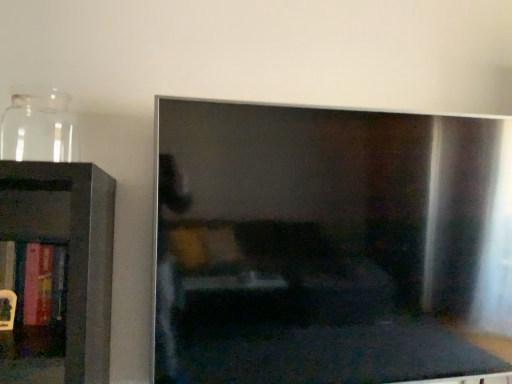
Question: In the image, is transparent glass jar at left on the left side or the right side of hardcover book at left?

Choices:
 (A) right
 (B) left

Answer: (A)

Question: Is transparent glass jar at left in front of or behind hardcover book at left in the image?

Choices:
 (A) behind
 (B) front

Answer: (B)

Question: Looking at their shapes, would you say transparent glass jar at left is wider or thinner than hardcover book at left?

Choices:
 (A) wide
 (B) thin

Answer: (A)

Question: Based on their sizes in the image, would you say hardcover book at left is bigger or smaller than transparent glass jar at left?

Choices:
 (A) small
 (B) big

Answer: (B)

Question: From the image's perspective, is hardcover book at left located above or below transparent glass jar at left?

Choices:
 (A) above
 (B) below

Answer: (B)

Question: Do you think hardcover book at left is within transparent glass jar at left, or outside of it?

Choices:
 (A) inside
 (B) outside

Answer: (B)

Question: Is hardcover book at left to the left or to the right of transparent glass jar at left in the image?

Choices:
 (A) left
 (B) right

Answer: (A)